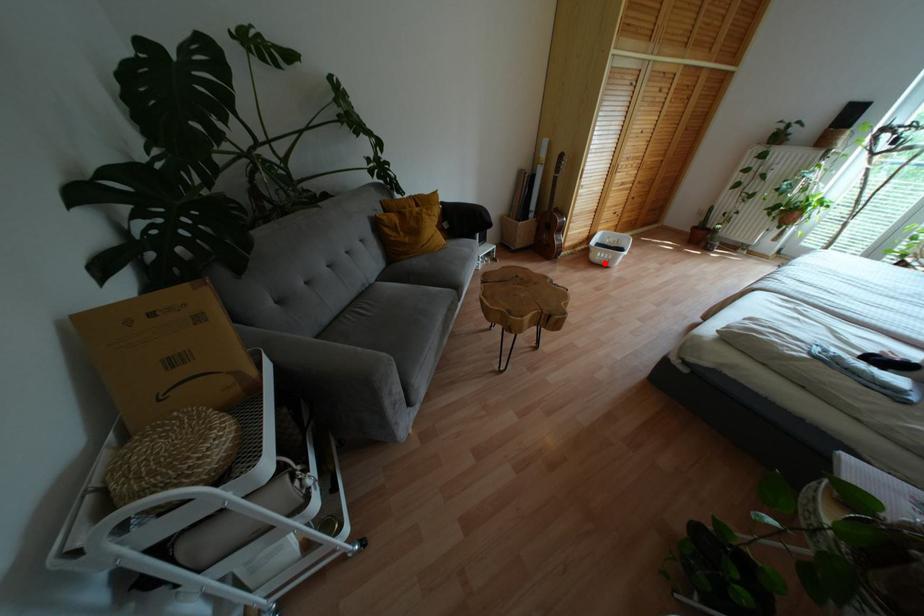
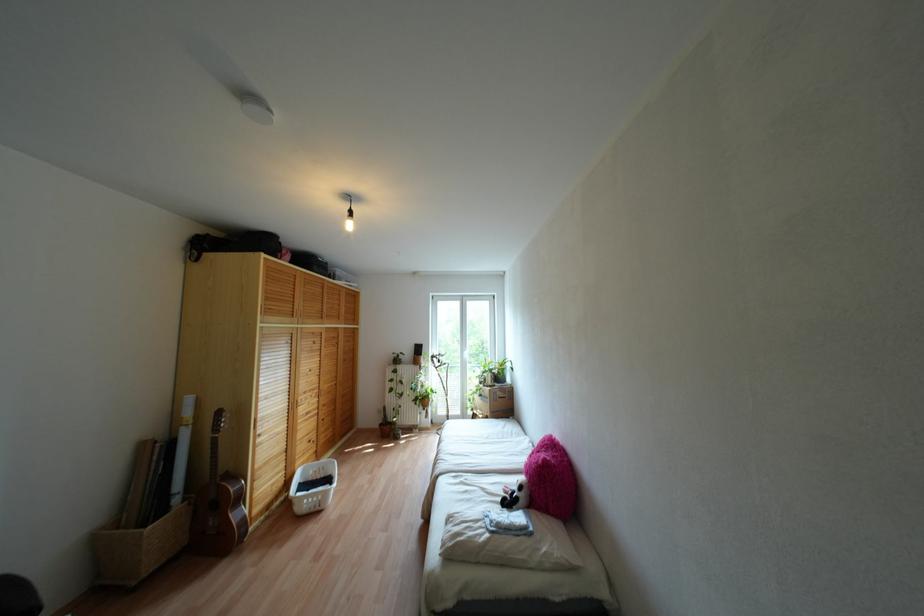
In the second image, find the point that corresponds to the highlighted location in the first image.

(317, 508)